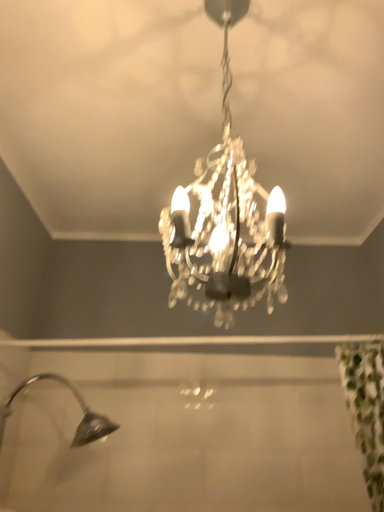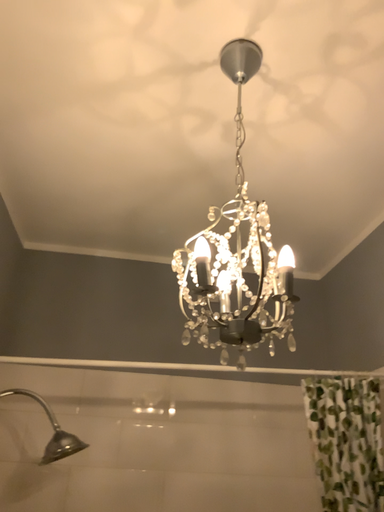
Question: Which way did the camera rotate in the video?

Choices:
 (A) rotated left
 (B) rotated right

Answer: (B)